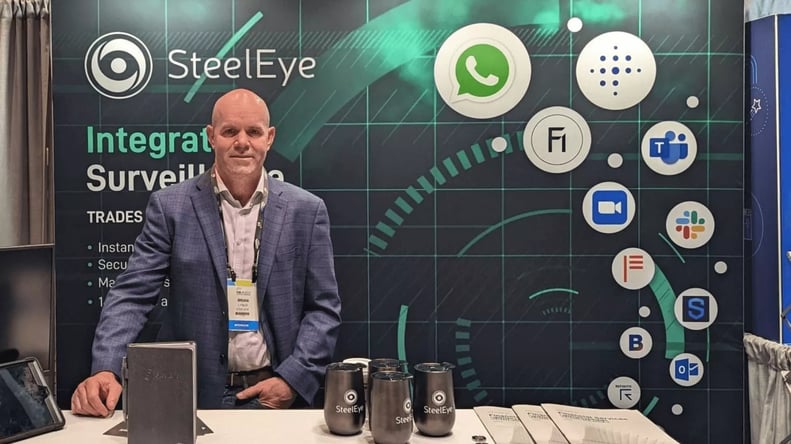
I want to click on white table, so click(x=284, y=425).